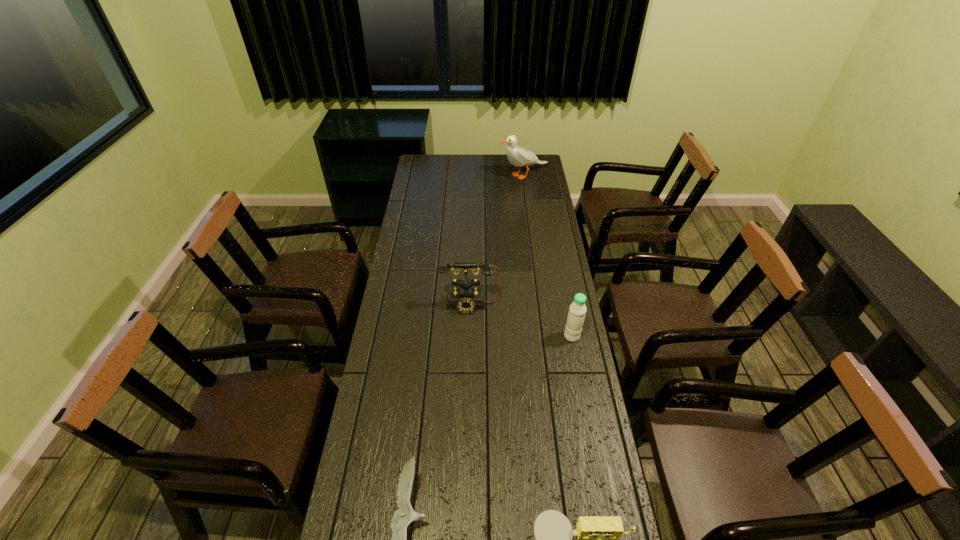
Identify the location of the taller gull. The width and height of the screenshot is (960, 540). (518, 156).

This screenshot has height=540, width=960. I want to click on the farther gull, so click(x=518, y=156).

Identify the location of telephone. (465, 299).

I want to click on the third nearest object, so click(x=577, y=310).

Identify the location of vacant space situated 0.070m at the beak of the right gull. The height and width of the screenshot is (540, 960). (487, 175).

The image size is (960, 540). Find the location of `free spot located at the beak of the right gull`. free spot located at the beak of the right gull is located at coordinates (475, 175).

This screenshot has height=540, width=960. I want to click on vacant space located at the beak of the right gull, so [x=470, y=175].

The height and width of the screenshot is (540, 960). I want to click on vacant space situated 0.300m on the dial of the second farthest object, so click(x=468, y=383).

Where is `free space located on the back of the water bottle`? Image resolution: width=960 pixels, height=540 pixels. free space located on the back of the water bottle is located at coordinates (564, 289).

Find the location of a particular element. The height and width of the screenshot is (540, 960). object located in the far edge section of the desktop is located at coordinates (518, 156).